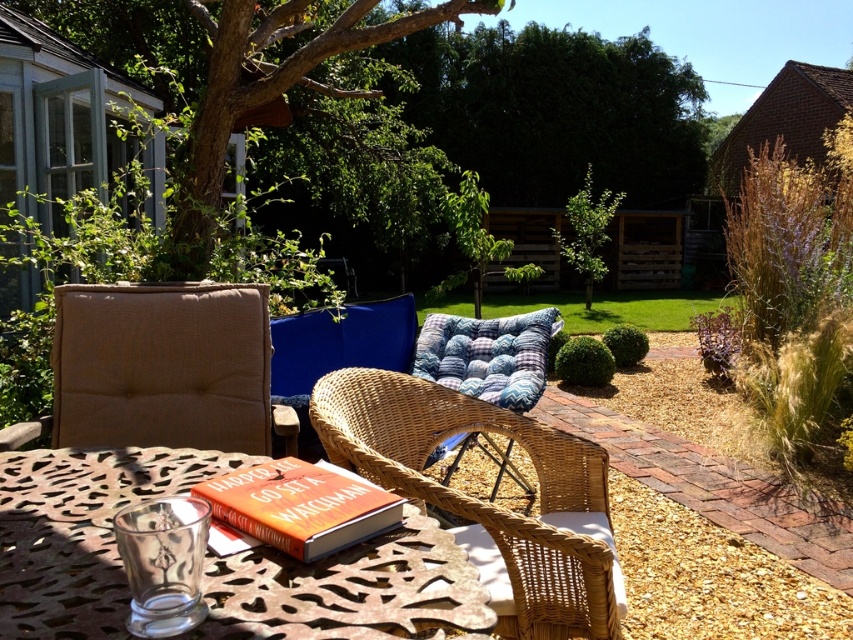
Question: Is green leafy tree at upper left wider than green leafy tree at center?

Choices:
 (A) yes
 (B) no

Answer: (A)

Question: Among these points, which one is farthest from the camera?

Choices:
 (A) (344, 509)
 (B) (184, 467)

Answer: (B)

Question: Is green leafy tree at upper center to the left of green leafy tree at upper left from the viewer's perspective?

Choices:
 (A) no
 (B) yes

Answer: (A)

Question: Which object is closer to the camera taking this photo?

Choices:
 (A) hardcover book at center
 (B) green leafy tree at upper left
 (C) metallic glass at center
 (D) green leafy tree at upper center

Answer: (C)

Question: Does green leafy tree at upper left appear under hardcover book at center?

Choices:
 (A) no
 (B) yes

Answer: (A)

Question: Which is farther from the green leafy tree at upper left?

Choices:
 (A) green leafy tree at center
 (B) green leafy tree at upper center
 (C) woven wicker armchair at center
 (D) metallic glass at center

Answer: (A)